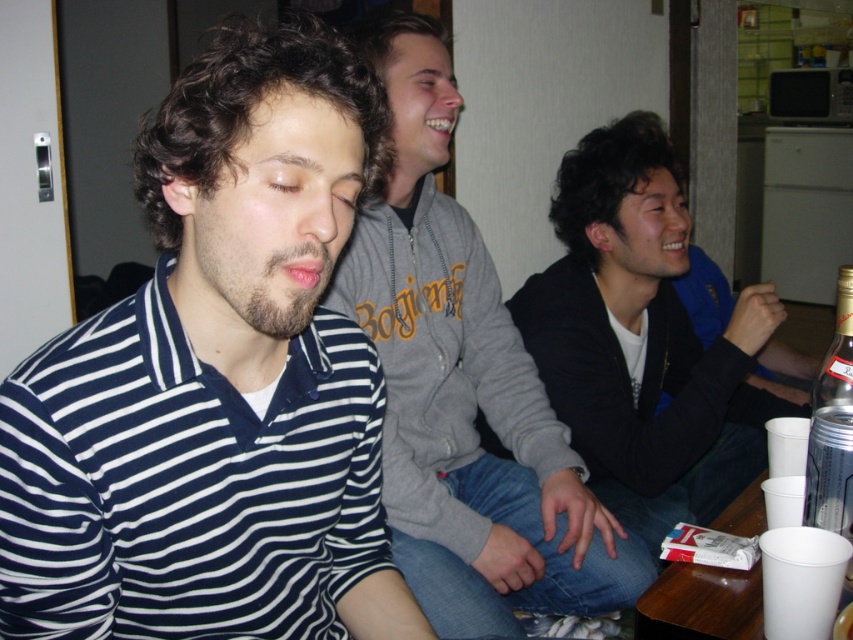
Question: Does striped cotton shirt at center have a lesser width compared to clear glass bottle at right?

Choices:
 (A) no
 (B) yes

Answer: (A)

Question: Can you confirm if gray fleece sweatshirt at center is wider than black matte jacket at center?

Choices:
 (A) yes
 (B) no

Answer: (B)

Question: Which object appears closest to the camera in this image?

Choices:
 (A) gray fleece sweatshirt at center
 (B) black matte jacket at center

Answer: (A)

Question: Estimate the real-world distances between objects in this image. Which object is closer to the black matte jacket at center?

Choices:
 (A) striped cotton shirt at center
 (B) gray fleece sweatshirt at center

Answer: (B)

Question: Estimate the real-world distances between objects in this image. Which object is farther from the black matte jacket at center?

Choices:
 (A) striped cotton shirt at center
 (B) white plastic cup at lower right

Answer: (A)

Question: Can you confirm if striped cotton shirt at center is wider than gray fleece sweatshirt at center?

Choices:
 (A) no
 (B) yes

Answer: (A)